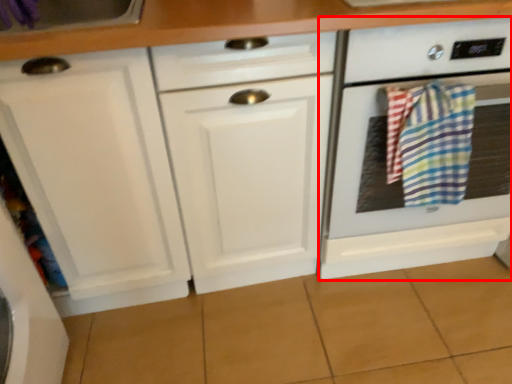
Question: From the image's perspective, what is the correct spatial positioning of home appliance (annotated by the red box) in reference to beach towel?

Choices:
 (A) above
 (B) below

Answer: (A)